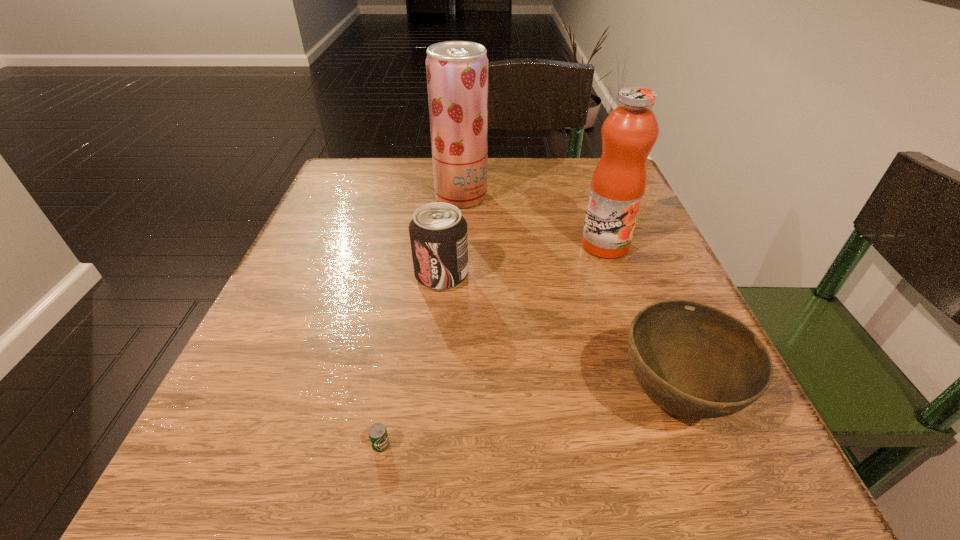
Locate an element on the screen. This screenshot has height=540, width=960. vacant space at the far left corner of the desktop is located at coordinates (345, 163).

In the image, there is a desktop. Identify the location of vacant space at the near left corner. This screenshot has width=960, height=540. (235, 523).

Where is `vacant space at the far right corner`? Image resolution: width=960 pixels, height=540 pixels. vacant space at the far right corner is located at coordinates (586, 160).

I want to click on vacant point located between the nearer fruit juice and the soda can, so point(523,260).

Locate an element on the screen. empty location between the soda can and the bowl is located at coordinates (558, 337).

You are a GUI agent. You are given a task and a screenshot of the screen. Output one action in this format:
    pyautogui.click(x=<x>, y=<y>)
    Task: Click on the free space between the right fruit juice and the beer can
    This screenshot has width=960, height=540.
    Given the screenshot: What is the action you would take?
    pyautogui.click(x=492, y=345)

Image resolution: width=960 pixels, height=540 pixels. Identify the location of vacant area between the bowl and the farther fruit juice. (567, 298).

At what (x,y) coordinates should I click in order to perform the action: click on vacant area that lies between the shortest object and the bowl. Please return your answer as a coordinate pair (x, y). Image resolution: width=960 pixels, height=540 pixels. Looking at the image, I should click on (527, 421).

Identify the location of vacant space that's between the soda can and the bowl. Image resolution: width=960 pixels, height=540 pixels. (558, 337).

I want to click on empty location between the right fruit juice and the soda can, so click(x=523, y=260).